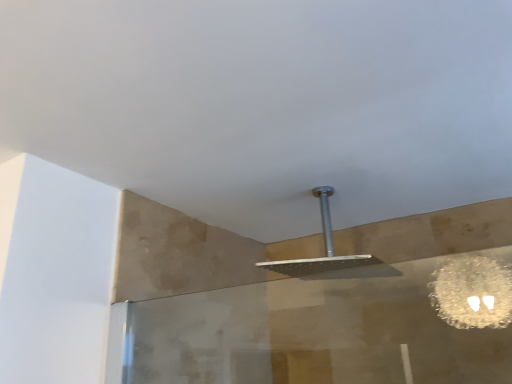
The width and height of the screenshot is (512, 384). Describe the element at coordinates (330, 255) in the screenshot. I see `silver metallic shower head at center` at that location.

This screenshot has width=512, height=384. I want to click on silver metallic shower head at center, so click(330, 255).

The height and width of the screenshot is (384, 512). Find the location of `silver metallic shower head at center`. silver metallic shower head at center is located at coordinates (330, 255).